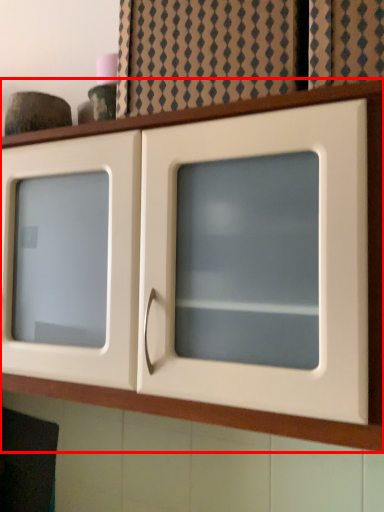
Question: From the image's perspective, what is the correct spatial positioning of cupboard (annotated by the red box) in reference to curtain?

Choices:
 (A) below
 (B) above

Answer: (A)